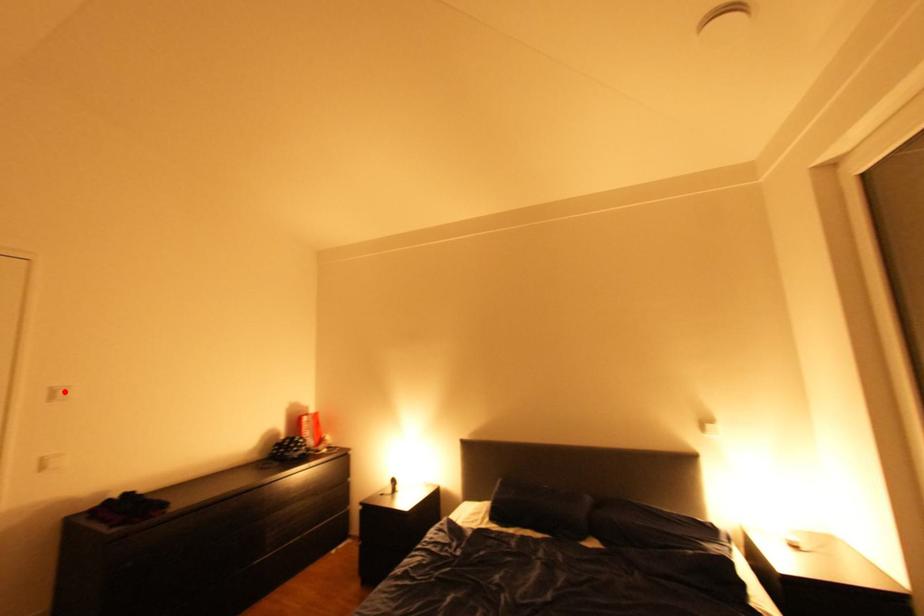
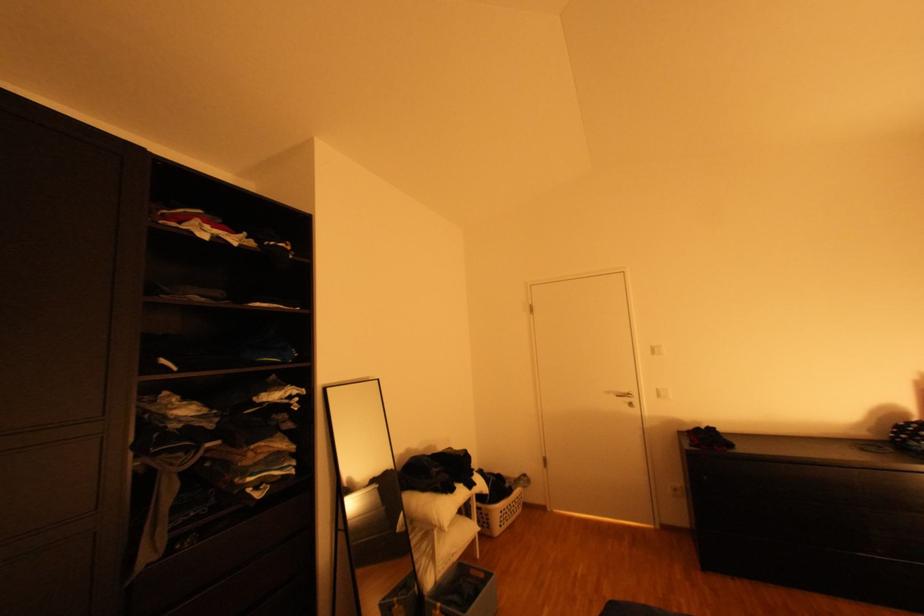
Where in the second image is the point corresponding to the highlighted location from the first image?

(662, 349)